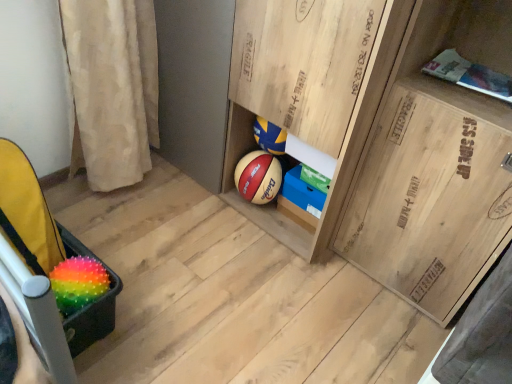
The width and height of the screenshot is (512, 384). What are the coordinates of `vacant space situated on the left part of wooden crate at right, which appears as the first cabinetry when viewed from the right` in the screenshot? It's located at (303, 279).